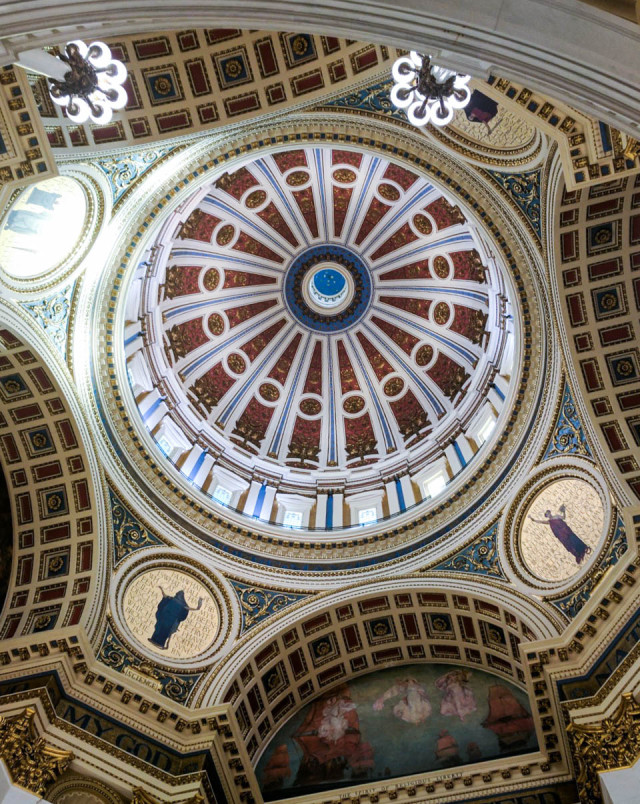
Locate an element on the screen. The width and height of the screenshot is (640, 804). lights is located at coordinates (91, 85), (404, 88).